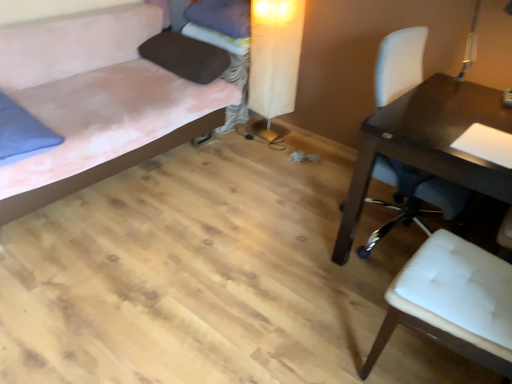
Question: Is white leather chair at right, which ranks as the second chair in front-to-back order, closer to camera compared to brown fabric pillow at upper center, the 2th pillow positioned from the top?

Choices:
 (A) no
 (B) yes

Answer: (B)

Question: From a real-world perspective, is white leather chair at right, which ranks as the second chair in front-to-back order, beneath brown fabric pillow at upper center, the second pillow positioned from the bottom?

Choices:
 (A) no
 (B) yes

Answer: (B)

Question: Considering the relative positions of white leather chair at right, the 1th chair viewed from the back, and brown fabric pillow at upper center, the 2th pillow positioned from the top, in the image provided, is white leather chair at right, the 1th chair viewed from the back, to the left of brown fabric pillow at upper center, the 2th pillow positioned from the top, from the viewer's perspective?

Choices:
 (A) yes
 (B) no

Answer: (B)

Question: Is white leather chair at right, which ranks as the second chair in front-to-back order, positioned beyond the bounds of brown fabric pillow at upper center, the second pillow positioned from the bottom?

Choices:
 (A) no
 (B) yes

Answer: (B)

Question: Is white leather chair at right, which ranks as the second chair in front-to-back order, bigger than brown fabric pillow at upper center, the 2th pillow positioned from the top?

Choices:
 (A) yes
 (B) no

Answer: (A)

Question: From their relative heights in the image, would you say beige fabric table lamp at center is taller or shorter than blue fabric pillow at left, the first pillow in the bottom-to-top sequence?

Choices:
 (A) short
 (B) tall

Answer: (B)

Question: Is beige fabric table lamp at center wider or thinner than blue fabric pillow at left, the first pillow in the bottom-to-top sequence?

Choices:
 (A) wide
 (B) thin

Answer: (B)

Question: Considering their positions, is beige fabric table lamp at center located in front of or behind blue fabric pillow at left, the first pillow in the bottom-to-top sequence?

Choices:
 (A) front
 (B) behind

Answer: (B)

Question: From the image's perspective, is beige fabric table lamp at center located above or below blue fabric pillow at left, the first pillow in the bottom-to-top sequence?

Choices:
 (A) above
 (B) below

Answer: (A)

Question: Considering their positions, is purple fabric pillow at upper center, placed as the 1th pillow when sorted from top to bottom, located in front of or behind suede-like pink bed at left?

Choices:
 (A) behind
 (B) front

Answer: (A)

Question: Is purple fabric pillow at upper center, placed as the 1th pillow when sorted from top to bottom, taller or shorter than suede-like pink bed at left?

Choices:
 (A) short
 (B) tall

Answer: (A)

Question: Is purple fabric pillow at upper center, placed as the 1th pillow when sorted from top to bottom, to the left or to the right of suede-like pink bed at left in the image?

Choices:
 (A) left
 (B) right

Answer: (B)

Question: In terms of width, does purple fabric pillow at upper center, the 3th pillow positioned from the bottom, look wider or thinner when compared to suede-like pink bed at left?

Choices:
 (A) thin
 (B) wide

Answer: (A)

Question: In terms of height, does suede-like pink bed at left look taller or shorter compared to white leather chair at right, the 1th chair viewed from the back?

Choices:
 (A) tall
 (B) short

Answer: (B)

Question: In terms of width, does suede-like pink bed at left look wider or thinner when compared to white leather chair at right, the 1th chair viewed from the back?

Choices:
 (A) thin
 (B) wide

Answer: (B)